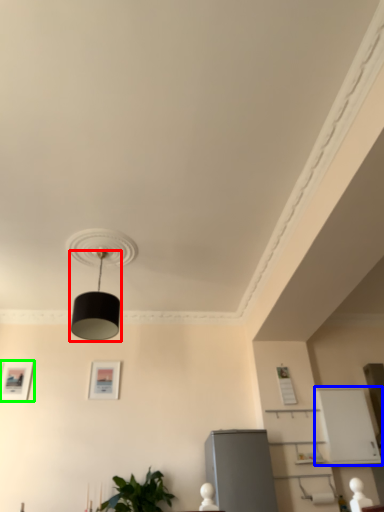
Question: Based on their relative distances, which object is nearer to lamp (highlighted by a red box)? Choose from shelf (highlighted by a blue box) and picture frame (highlighted by a green box).

Choices:
 (A) shelf
 (B) picture frame

Answer: (B)